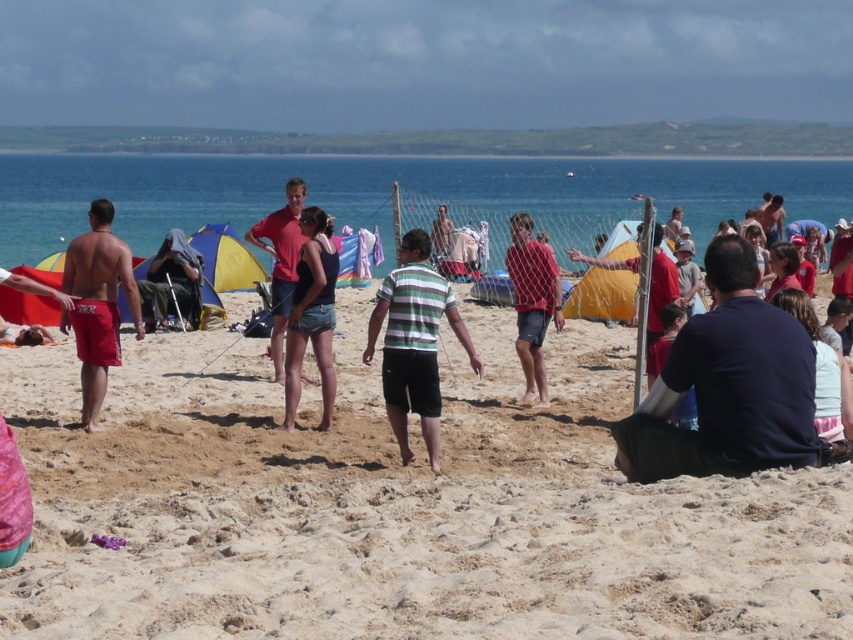
Question: Can you confirm if striped cotton shirt at center is thinner than denim shorts at center?

Choices:
 (A) yes
 (B) no

Answer: (B)

Question: Considering the real-world distances, which object is farthest from the denim shorts at center?

Choices:
 (A) dark blue fabric at center
 (B) striped cotton shirt at center
 (C) red matte shirt at center
 (D) matte red shorts at left

Answer: (A)

Question: Can you confirm if striped cotton shirt at center is smaller than denim shorts at center?

Choices:
 (A) yes
 (B) no

Answer: (B)

Question: Which point appears farthest from the camera in this image?

Choices:
 (A) pyautogui.click(x=531, y=392)
 (B) pyautogui.click(x=312, y=333)
 (C) pyautogui.click(x=180, y=285)
 (D) pyautogui.click(x=440, y=300)

Answer: (C)

Question: Does denim shorts at center have a lesser width compared to red matte shirt at center?

Choices:
 (A) yes
 (B) no

Answer: (B)

Question: Which of the following is the farthest from the observer?

Choices:
 (A) (543, 269)
 (B) (113, 237)

Answer: (A)